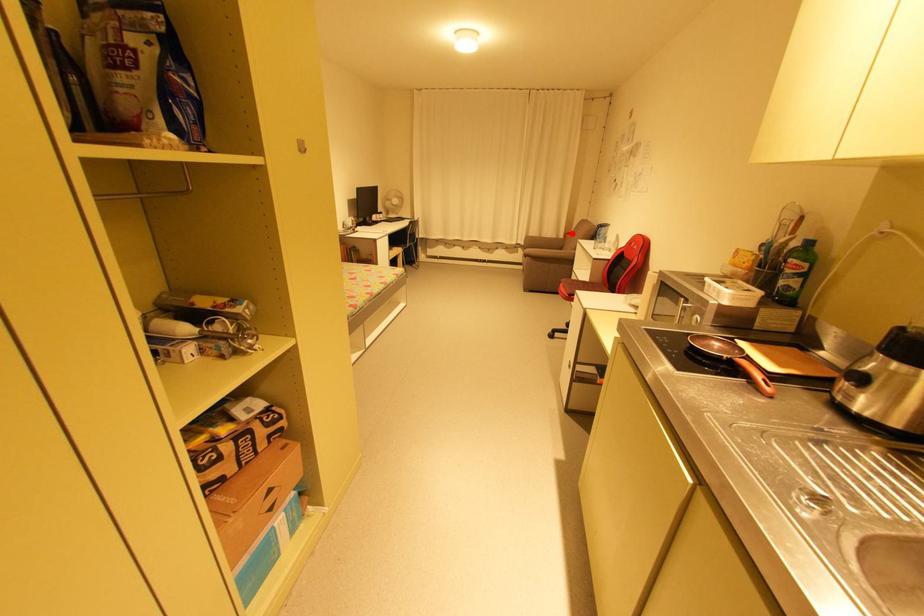
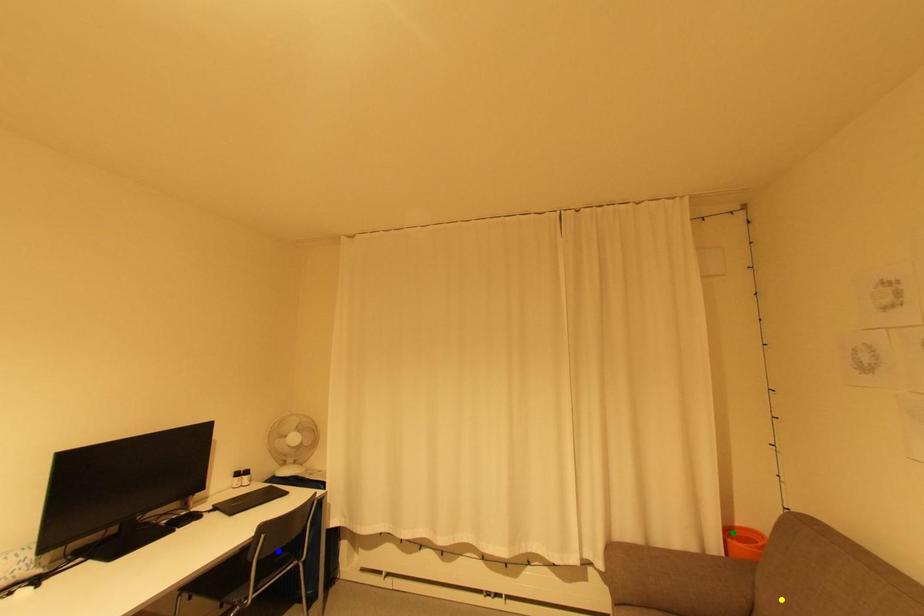
Question: I am providing you with two images of the same scene from different viewpoints. A red point is marked on the first image. You are given multiple points on the second image. Can you choose the point in image 2 that corresponds to the point in image 1?

Choices:
 (A) green point
 (B) yellow point
 (C) blue point

Answer: (A)